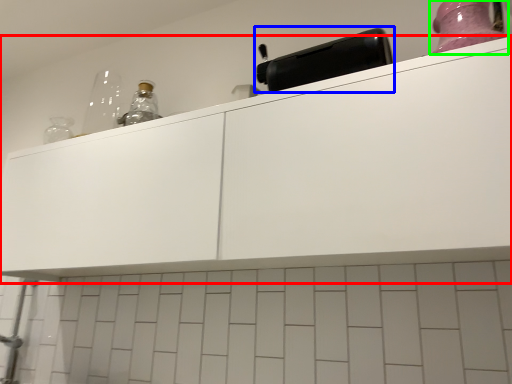
Question: Based on their relative distances, which object is farther from cabinetry (highlighted by a red box)? Choose from appliance (highlighted by a blue box) and bottle (highlighted by a green box).

Choices:
 (A) appliance
 (B) bottle

Answer: (B)